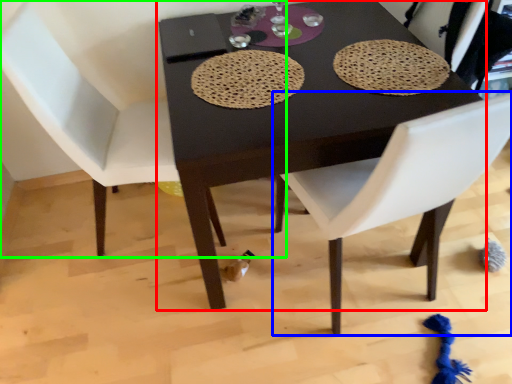
Question: Estimate the real-world distances between objects in this image. Which object is farther from table (highlighted by a red box), chair (highlighted by a blue box) or chair (highlighted by a green box)?

Choices:
 (A) chair
 (B) chair

Answer: (B)